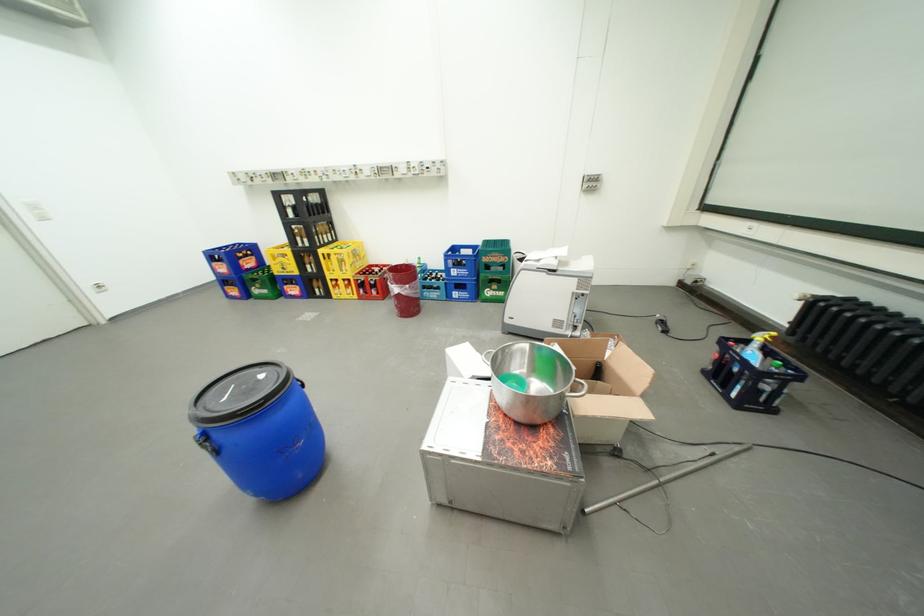
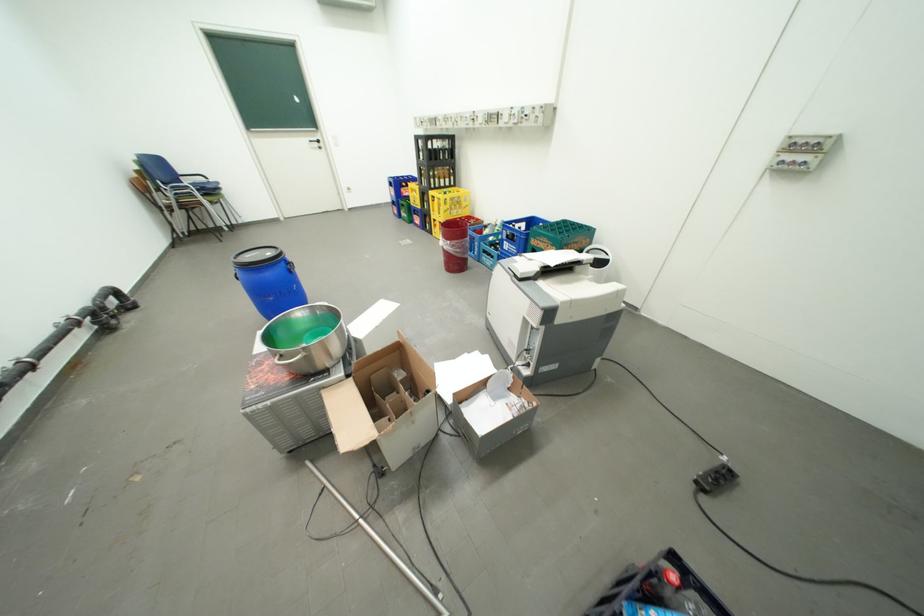
The point at (298, 217) is marked in the first image. Where is the corresponding point in the second image?

(430, 159)